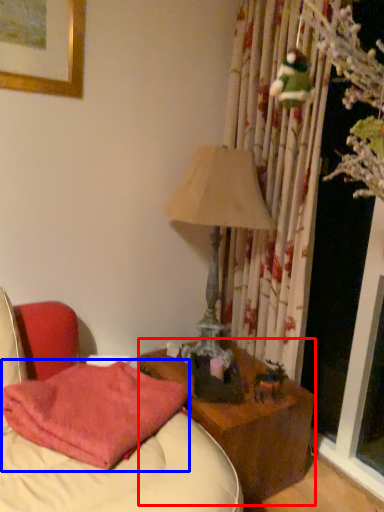
Question: Which object is closer to the camera taking this photo, nightstand (highlighted by a red box) or pillow (highlighted by a blue box)?

Choices:
 (A) nightstand
 (B) pillow

Answer: (B)